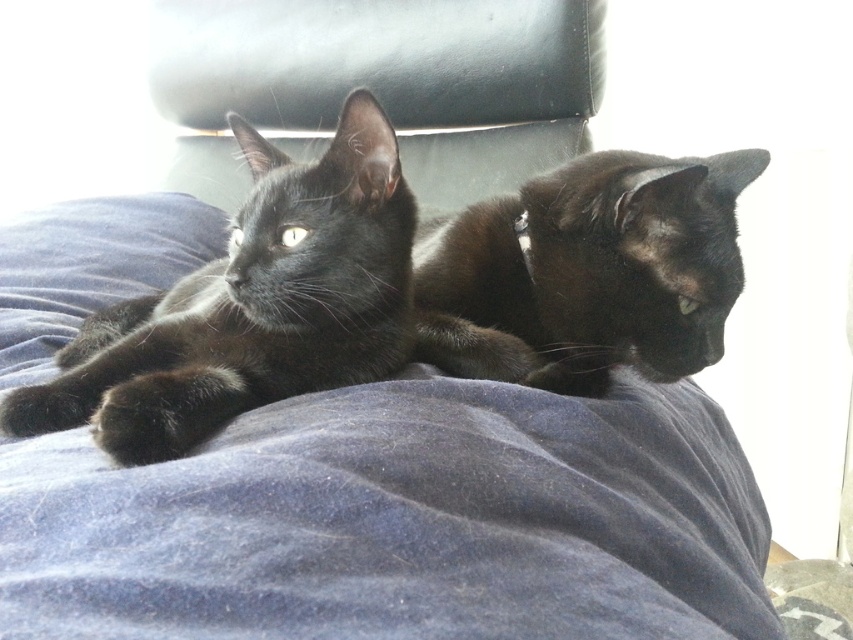
Question: Where is matte black cat at left located in relation to shiny black cat at center in the image?

Choices:
 (A) below
 (B) above

Answer: (A)

Question: Which object is the closest to the matte black cat at left?

Choices:
 (A) velvety blue blanket at center
 (B) shiny black cat at center

Answer: (A)

Question: Which point is closer to the camera?

Choices:
 (A) (99, 371)
 (B) (718, 552)

Answer: (A)

Question: Is velvety blue blanket at center below matte black cat at left?

Choices:
 (A) no
 (B) yes

Answer: (B)

Question: Which of the following is the closest to the observer?

Choices:
 (A) shiny black cat at center
 (B) velvety blue blanket at center

Answer: (B)

Question: Does velvety blue blanket at center have a smaller size compared to shiny black cat at center?

Choices:
 (A) yes
 (B) no

Answer: (B)